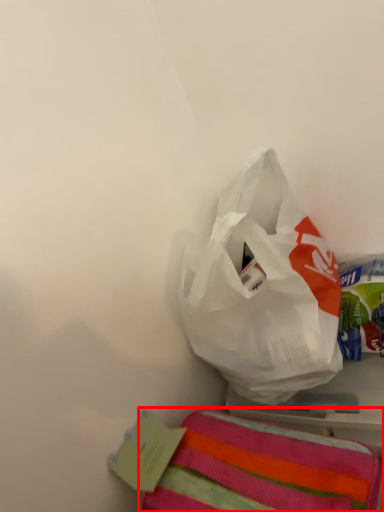
Question: Observing the image, what is the correct spatial positioning of towel (annotated by the red box) in reference to plastic bag?

Choices:
 (A) right
 (B) left

Answer: (B)